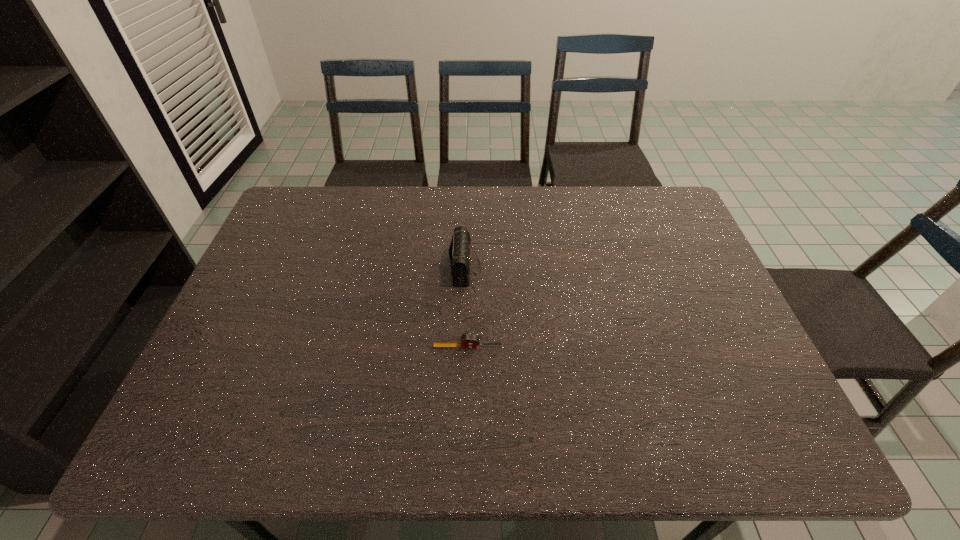
Identify the location of blank space at the near left corner of the desktop. (228, 426).

Identify the location of free space at the far right corner of the desktop. [660, 201].

In the image, there is a desktop. What are the coordinates of `blank space at the near right corner` in the screenshot? It's located at (770, 430).

This screenshot has width=960, height=540. What are the coordinates of `vacant position in the image that satisfies the following two spatial constraints: 1. on the front flap of the tape measure; 2. on the left side of the farther object` in the screenshot? It's located at (463, 347).

I want to click on vacant space that satisfies the following two spatial constraints: 1. on the front flap of the clutch bag; 2. on the left side of the nearer object, so click(463, 347).

Find the location of a particular element. vacant space that satisfies the following two spatial constraints: 1. on the front flap of the nearer object; 2. on the left side of the clutch bag is located at coordinates (463, 347).

I want to click on vacant space that satisfies the following two spatial constraints: 1. on the back side of the shorter object; 2. on the front flap of the clutch bag, so click(x=469, y=268).

Where is `free point that satisfies the following two spatial constraints: 1. on the front flap of the clutch bag; 2. on the right side of the tape measure`? The height and width of the screenshot is (540, 960). free point that satisfies the following two spatial constraints: 1. on the front flap of the clutch bag; 2. on the right side of the tape measure is located at coordinates (463, 347).

Identify the location of free space that satisfies the following two spatial constraints: 1. on the front flap of the shorter object; 2. on the left side of the farther object. (463, 347).

You are a GUI agent. You are given a task and a screenshot of the screen. Output one action in this format:
    pyautogui.click(x=<x>, y=<y>)
    Task: Click on the blank area in the image that satisfies the following two spatial constraints: 1. on the front flap of the taller object; 2. on the back side of the nearer object
    The image size is (960, 540).
    Given the screenshot: What is the action you would take?
    pyautogui.click(x=463, y=347)